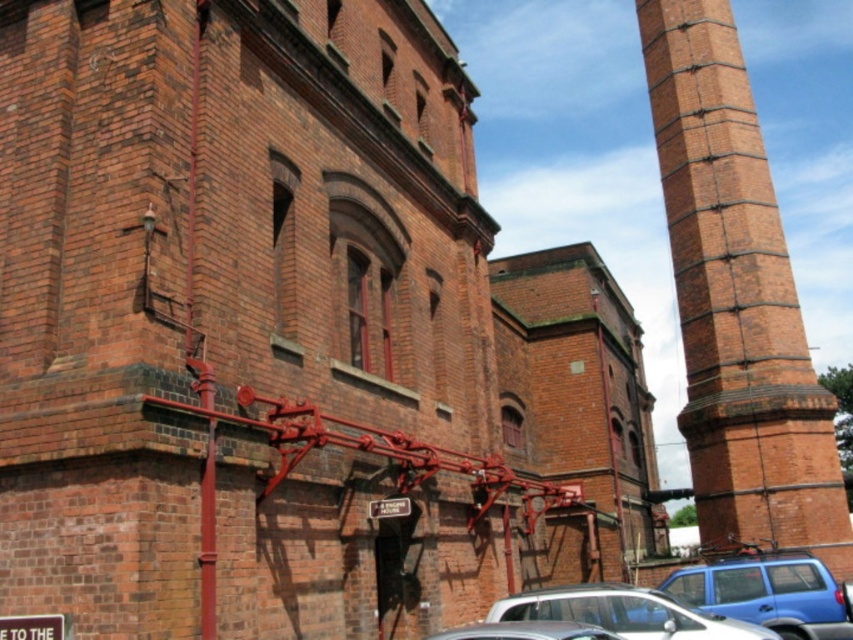
Does brick tower at right appear on the right side of silver metallic car at lower center?

Yes, brick tower at right is to the right of silver metallic car at lower center.

Is brick tower at right further to camera compared to silver metallic car at lower center?

That is True.

Where is `brick tower at right`? The height and width of the screenshot is (640, 853). brick tower at right is located at coordinates (735, 300).

This screenshot has height=640, width=853. I want to click on brick tower at right, so (735, 300).

Who is more distant from viewer, (735, 564) or (593, 605)?

The point (735, 564) is more distant.

Is blue matte car at lower right positioned before silver metallic car at lower center?

No.

Between point (848, 584) and point (489, 611), which one is positioned in front?

Point (489, 611) is more forward.

Where is `blue matte car at lower right`? blue matte car at lower right is located at coordinates (764, 593).

Is brick tower at right further to camera compared to blue matte car at lower right?

Yes, it is.

Is brick tower at right to the right of blue matte car at lower right from the viewer's perspective?

Yes, brick tower at right is to the right of blue matte car at lower right.

The image size is (853, 640). What do you see at coordinates (735, 300) in the screenshot?
I see `brick tower at right` at bounding box center [735, 300].

What are the coordinates of `brick tower at right` in the screenshot? It's located at (735, 300).